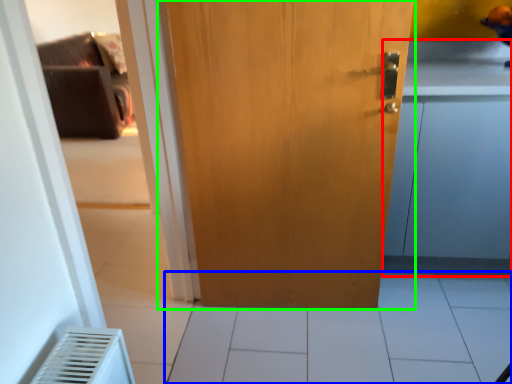
Question: Which object is the closest to the cabinetry (highlighted by a red box)? Choose among these: tile (highlighted by a blue box) or door (highlighted by a green box).

Choices:
 (A) tile
 (B) door

Answer: (B)